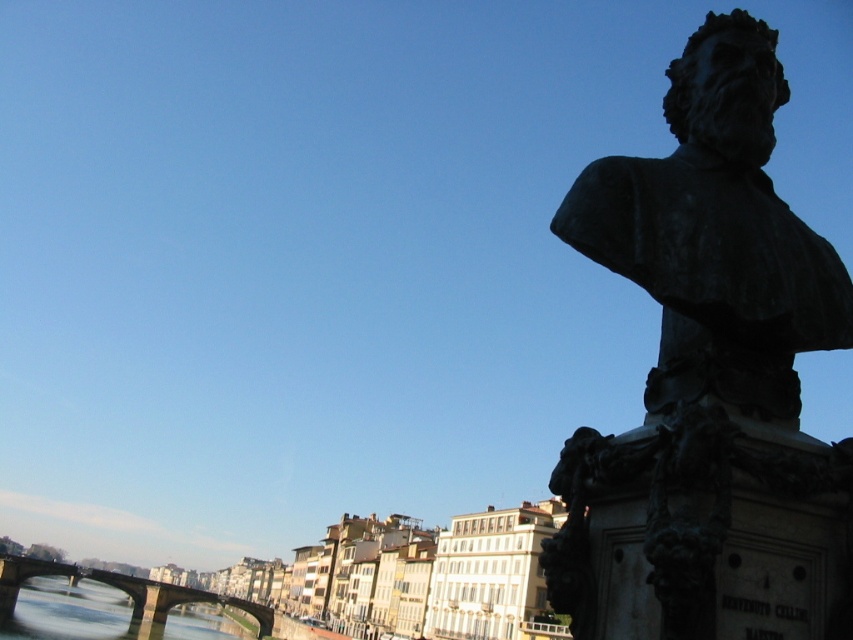
Between bronze bust at right and concrete bridge at lower left, which one appears on the left side from the viewer's perspective?

concrete bridge at lower left

Does bronze bust at right appear on the right side of concrete bridge at lower left?

Yes, bronze bust at right is to the right of concrete bridge at lower left.

Is point (695, 380) less distant than point (103, 582)?

Yes, it is.

I want to click on bronze bust at right, so click(709, 381).